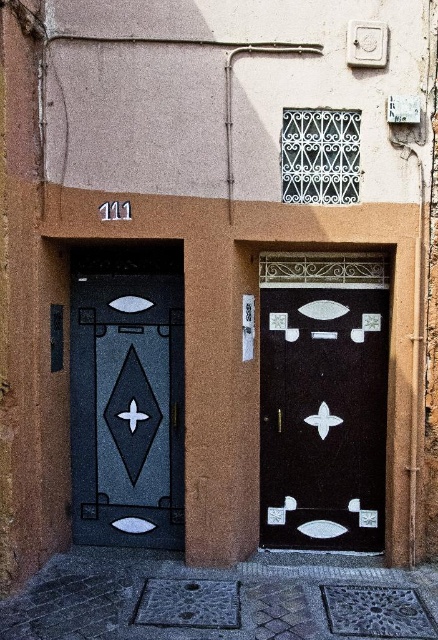
Question: Can you confirm if smooth stone pavement at lower center is wider than matte black door at center?

Choices:
 (A) no
 (B) yes

Answer: (B)

Question: Which of the following is the closest to the observer?

Choices:
 (A) (13, 602)
 (B) (180, 490)

Answer: (A)

Question: Does black glossy door at center have a larger size compared to matte black door at center?

Choices:
 (A) yes
 (B) no

Answer: (B)

Question: Which object is positioned closest to the matte black door at center?

Choices:
 (A) black glossy door at center
 (B) smooth stone pavement at lower center

Answer: (A)

Question: Can you confirm if smooth stone pavement at lower center is bigger than black glossy door at center?

Choices:
 (A) no
 (B) yes

Answer: (B)

Question: Which point is closer to the camera?

Choices:
 (A) black glossy door at center
 (B) matte black door at center

Answer: (A)